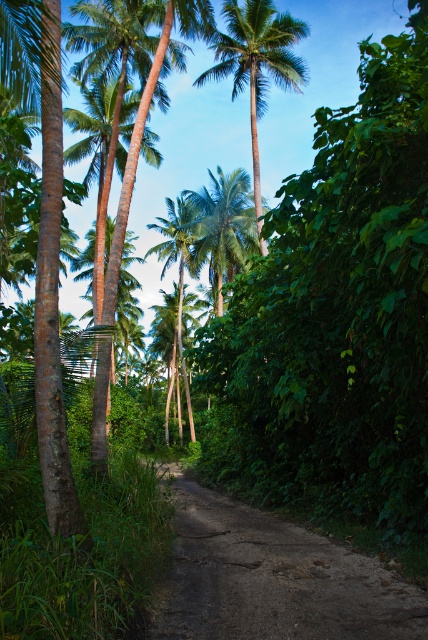
You are a hiker walking along the narrow dirt path in the tropical scene. You notice two green leafy palm trees ahead. One is labeled as the green leafy palm tree at upper center, and the other is the green leafy palm tree at center. Which of these two palm trees is closer to you as you walk along the path?

The green leafy palm tree at upper center is closer to you because it is positioned in front of the green leafy palm tree at center.

You are a hiker navigating the narrow dirt path in the tropical scene. You notice two points marked on your map at coordinates point (338,582) and point (252,17). Which point is closer to your current position if you are standing on the path looking forward?

Point (338,582) is in front of point (252,17), so the closer point to your current position would be point (338,582).